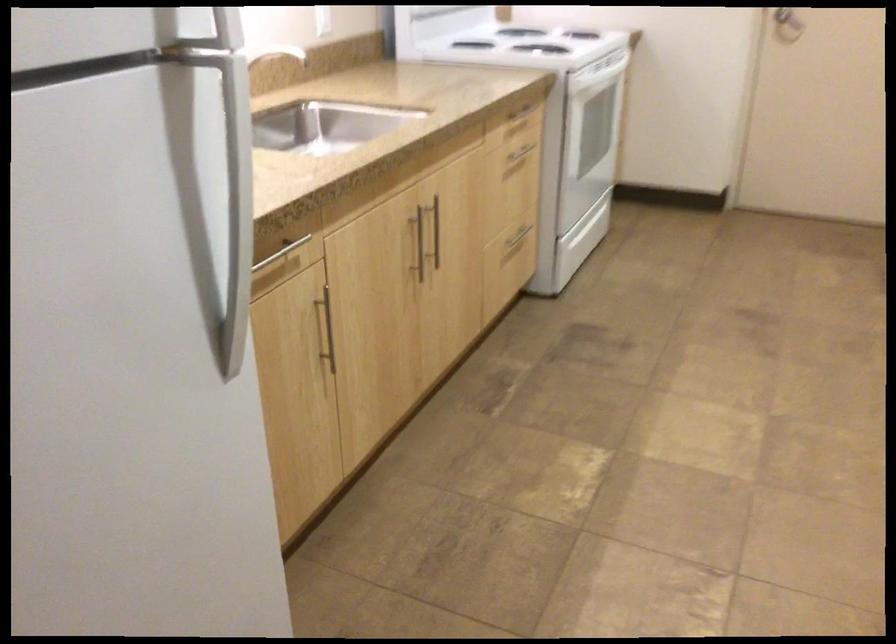
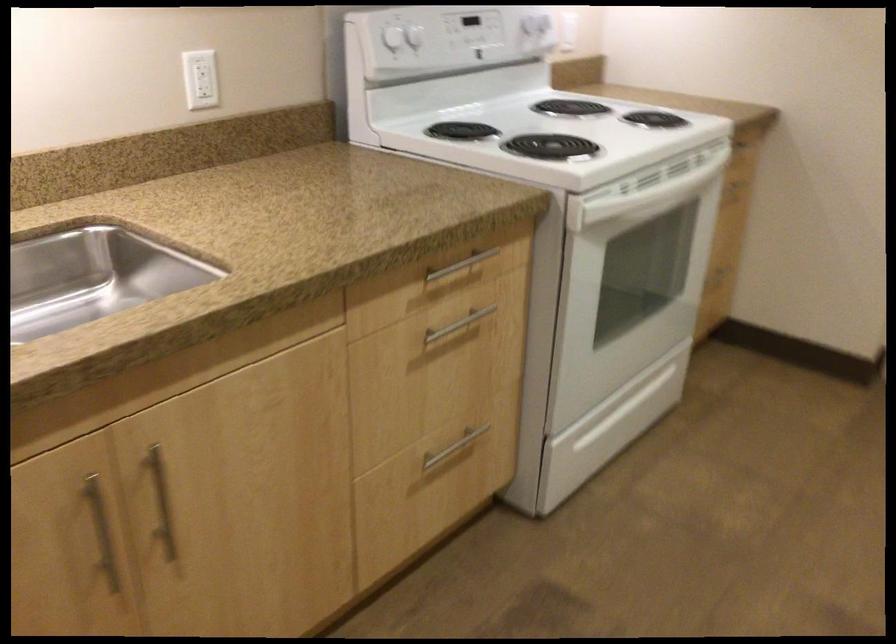
Question: I am providing you with two images of the same scene from different viewpoints. Which of the following objects are not visible in image2?

Choices:
 (A) white light switch
 (B) metal drawer handle
 (C) metal cabinet handle
 (D) none of these

Answer: (D)